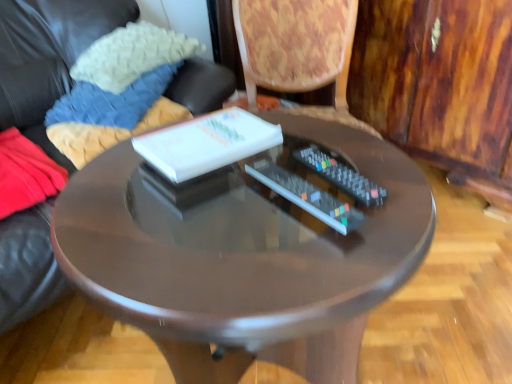
Question: Looking at their shapes, would you say soft woolen pillow at upper left, the first pillow from the bottom, is wider or thinner than white glossy book at center?

Choices:
 (A) wide
 (B) thin

Answer: (A)

Question: Is point (79, 157) closer or farther from the camera than point (181, 165)?

Choices:
 (A) farther
 (B) closer

Answer: (A)

Question: Which is nearer to the matte black remote control at center, positioned as the second remote control in right-to-left order?

Choices:
 (A) glossy wood table at center
 (B) black plastic remote at center, which is the second remote control from left to right
 (C) soft woolen pillow at upper left, the first pillow from the bottom
 (D) white glossy book at center
 (E) white knitted pillow at upper left, which is the 1th pillow in top-to-bottom order

Answer: (B)

Question: Which of these objects is positioned closest to the white knitted pillow at upper left, which is the 1th pillow in top-to-bottom order?

Choices:
 (A) matte black remote control at center, positioned as the second remote control in right-to-left order
 (B) glossy wood table at center
 (C) black plastic remote at center, which appears as the first remote control when viewed from the right
 (D) white glossy book at center
 (E) soft woolen pillow at upper left, which is counted as the 2th pillow, starting from the top

Answer: (E)